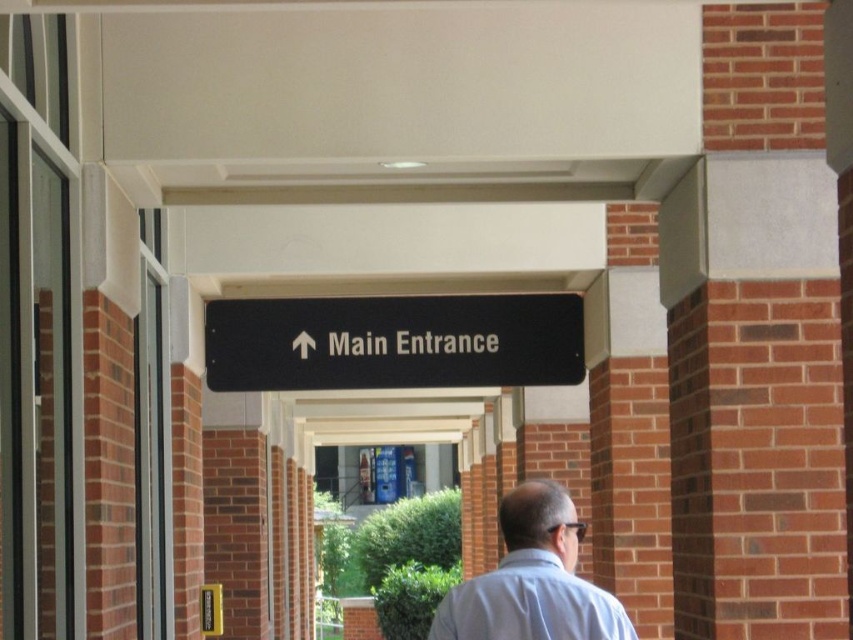
You are standing at the entrance of the corridor and see a black plastic sign at center and a light blue shirt at center. Which object is closer to your right side?

The light blue shirt at center is closer to your right side because the black plastic sign at center is positioned on the left side of it.

You are standing at the entrance of the corridor and want to see the black plastic sign at center and the light blue shirt at center. Which object is bigger in your view?

The black plastic sign at center has a larger size compared to the light blue shirt at center, so the black plastic sign at center appears bigger in your view.